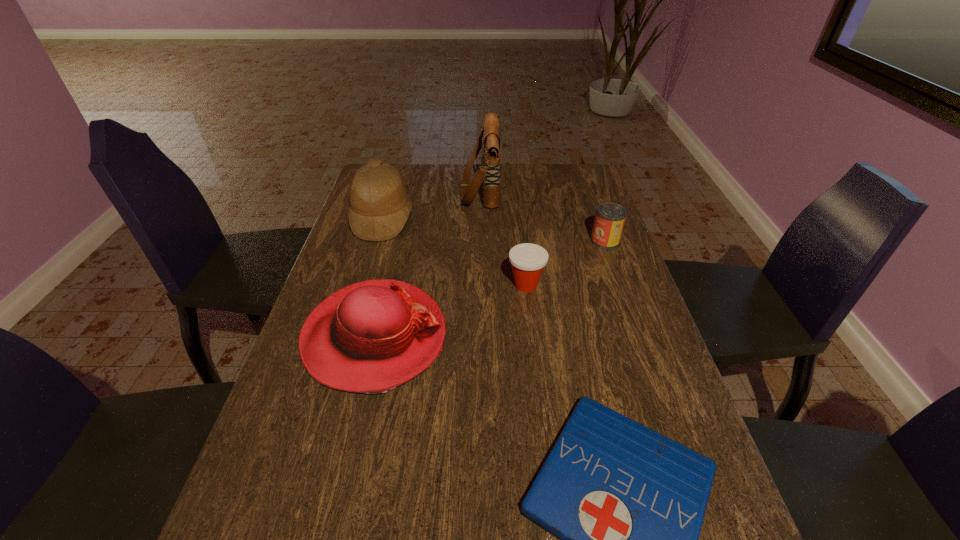
The width and height of the screenshot is (960, 540). In order to click on vacant position in the image that satisfies the following two spatial constraints: 1. on the front-facing side of the taller hat; 2. on the right side of the can in this screenshot , I will do `click(375, 241)`.

Locate an element on the screen. This screenshot has width=960, height=540. free space in the image that satisfies the following two spatial constraints: 1. on the front-facing side of the can; 2. on the right side of the shoulder bag is located at coordinates (480, 241).